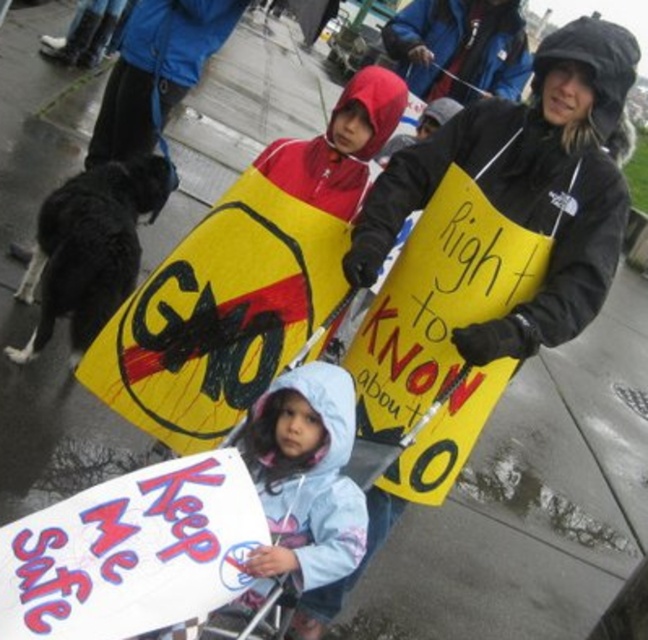
Question: Which of the following is the farthest from the observer?

Choices:
 (A) blue hooded jacket at upper center
 (B) light blue fabric jacket at center
 (C) yellow paper sign at center

Answer: (A)

Question: Based on their relative distances, which object is farther from the light blue fabric jacket at center?

Choices:
 (A) yellow paper sign at center
 (B) blue hooded jacket at upper center

Answer: (B)

Question: Which point is farther from the camera taking this photo?

Choices:
 (A) (599, 244)
 (B) (397, 29)
 (C) (281, 468)

Answer: (B)

Question: Is yellow paper sign at center in front of light blue fabric jacket at center?

Choices:
 (A) no
 (B) yes

Answer: (A)

Question: Does yellow paper sign at center lie in front of light blue fabric jacket at center?

Choices:
 (A) no
 (B) yes

Answer: (A)

Question: Considering the relative positions of yellow paper sign at center and light blue fabric jacket at center in the image provided, where is yellow paper sign at center located with respect to light blue fabric jacket at center?

Choices:
 (A) above
 (B) below

Answer: (A)